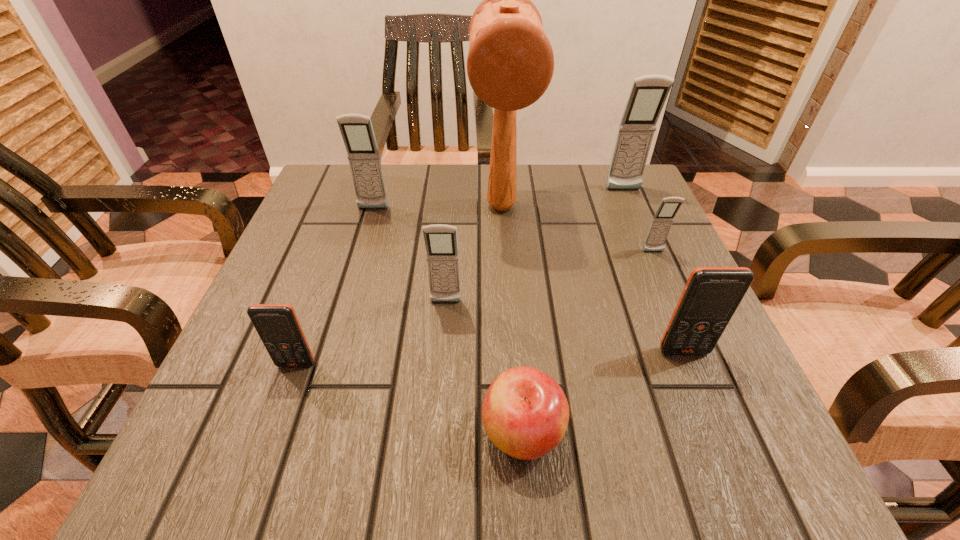
What are the coordinates of `the nearer orange cellular telephone` in the screenshot? It's located at (277, 325).

Locate an element on the screen. the second nearest gray cellular telephone is located at coordinates (662, 221).

Locate an element on the screen. This screenshot has height=540, width=960. the fourth nearest cellular telephone is located at coordinates (662, 221).

In order to click on the nearest object in this screenshot , I will do pos(525,413).

Image resolution: width=960 pixels, height=540 pixels. I want to click on apple, so click(525, 413).

Where is `free point located 0.070m on the strike surface of the tallest object`? The image size is (960, 540). free point located 0.070m on the strike surface of the tallest object is located at coordinates (505, 261).

Find the location of a particular element. This screenshot has height=540, width=960. vacant space situated on the front-facing side of the farthest gray cellular telephone is located at coordinates (668, 296).

The width and height of the screenshot is (960, 540). I want to click on vacant space positioned 0.270m on the front-facing side of the second tallest cellular telephone, so click(345, 302).

Where is `blank area located 0.130m on the front-facing side of the sixth object from right to left`? This screenshot has width=960, height=540. blank area located 0.130m on the front-facing side of the sixth object from right to left is located at coordinates (441, 370).

Locate an element on the screen. This screenshot has width=960, height=540. vacant space positioned on the screen of the sixth farthest object is located at coordinates (700, 390).